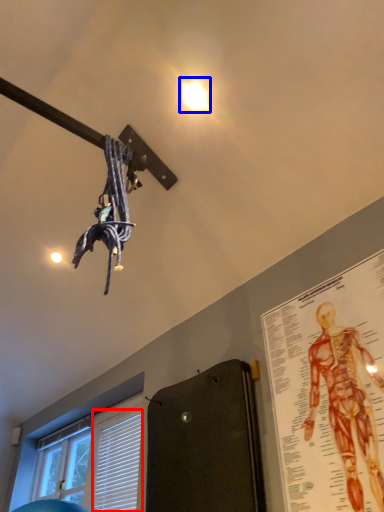
Question: Which of the following is the farthest to the observer, blind (highlighted by a red box) or droplight (highlighted by a blue box)?

Choices:
 (A) blind
 (B) droplight

Answer: (A)